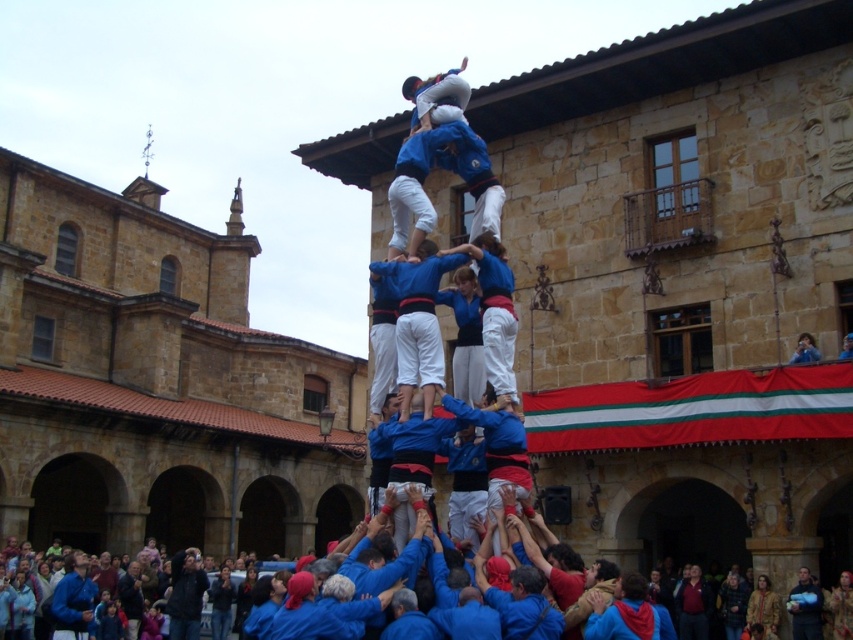
Between blue cotton shirt at center and blue fabric person at center, which one has more height?

blue cotton shirt at center is taller.

Can you confirm if blue cotton shirt at center is bigger than blue fabric person at center?

Yes.

Is point (422, 266) positioned after point (808, 346)?

No, (422, 266) is in front of (808, 346).

You are a GUI agent. You are given a task and a screenshot of the screen. Output one action in this format:
    pyautogui.click(x=<x>, y=<y>)
    Task: Click on the blue cotton shirt at center
    This screenshot has height=640, width=853.
    Given the screenshot: What is the action you would take?
    pyautogui.click(x=416, y=320)